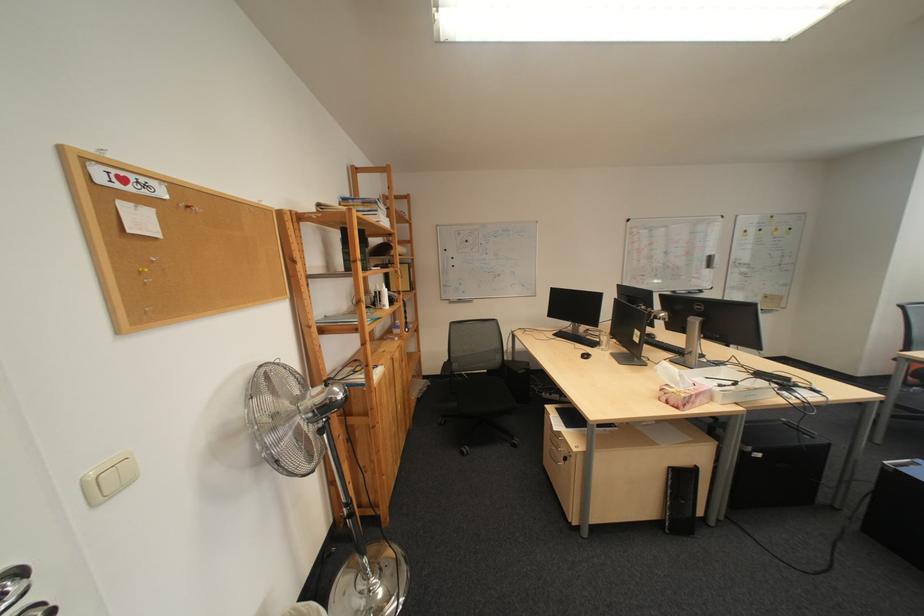
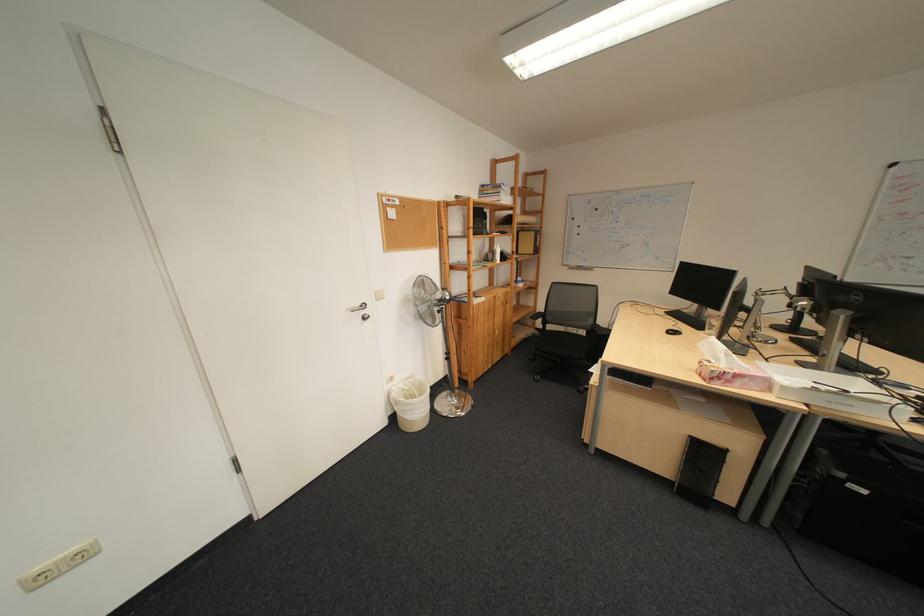
Where in the second image is the point corresponding to point 442,387 from the first image?

(548, 336)